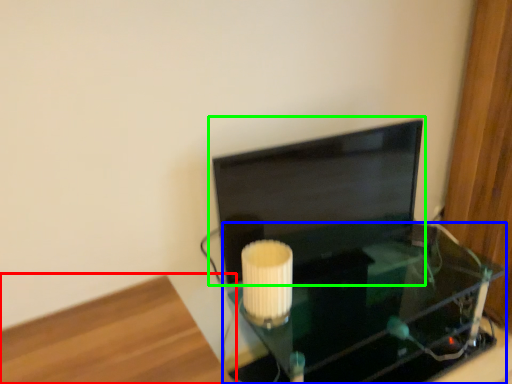
Question: Based on their relative distances, which object is farther from furniture (highlighted by a red box)? Choose from table (highlighted by a blue box) and computer monitor (highlighted by a green box).

Choices:
 (A) table
 (B) computer monitor

Answer: (A)